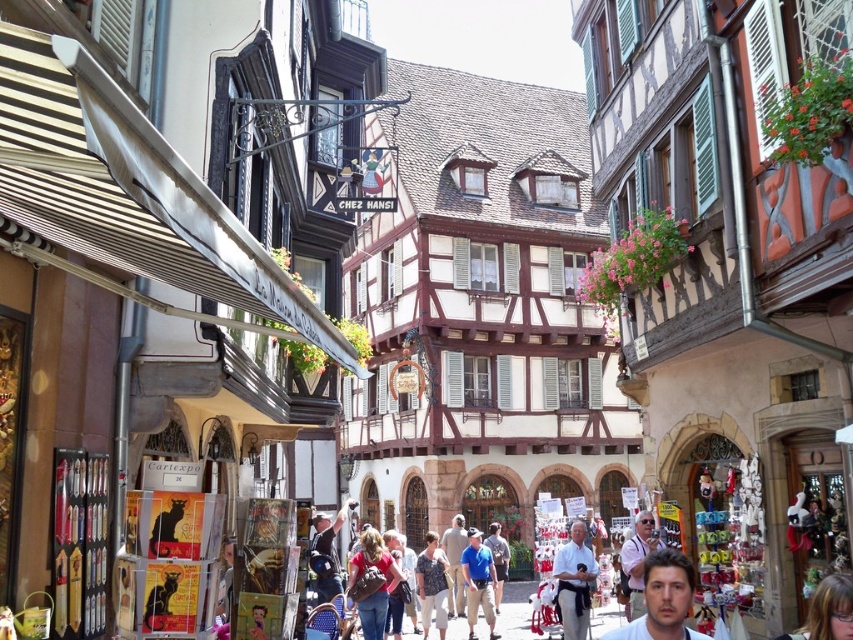
You are a photographer standing at the entrance of the historic building. You see the denim jeans at center and a camera. Which object is closer to you?

The denim jeans at center is closer to you than the camera since they are 169.80 feet apart from each other.

You are standing on the street in front of the historic building. There are two points marked on the building facade. The first point is at coordinates point (682, 563) and the second is at point (567, 579). Which point is closer to you?

Point (682, 563) is in front of point (567, 579), so the first point is closer to you.